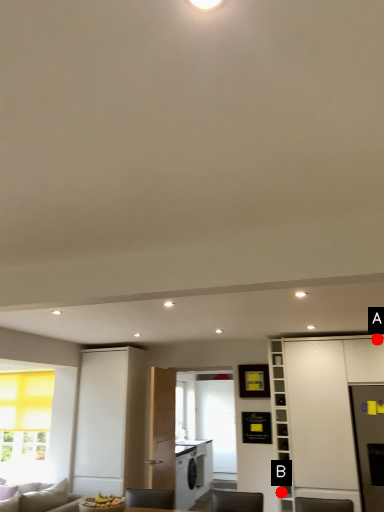
Question: Two points are circled on the image, labeled by A and B beside each circle. Which of the following is the closest to the observer?

Choices:
 (A) A is closer
 (B) B is closer

Answer: (B)